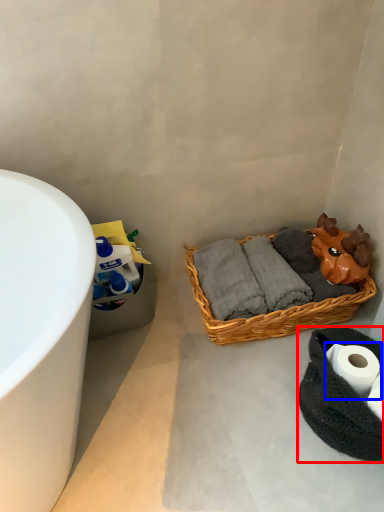
Question: Which object appears farthest to the camera in this image, material (highlighted by a red box) or toilet paper (highlighted by a blue box)?

Choices:
 (A) material
 (B) toilet paper

Answer: (B)